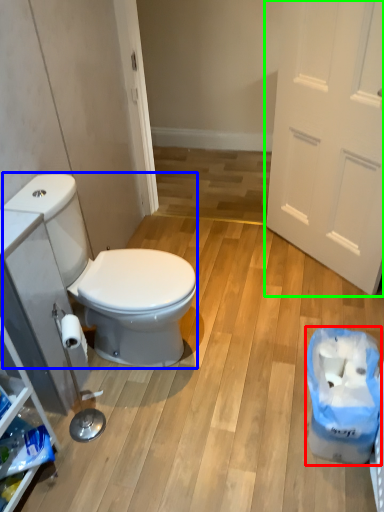
Question: Estimate the real-world distances between objects in this image. Which object is closer to recycling bin (highlighted by a red box), sit (highlighted by a blue box) or door (highlighted by a green box)?

Choices:
 (A) sit
 (B) door

Answer: (A)